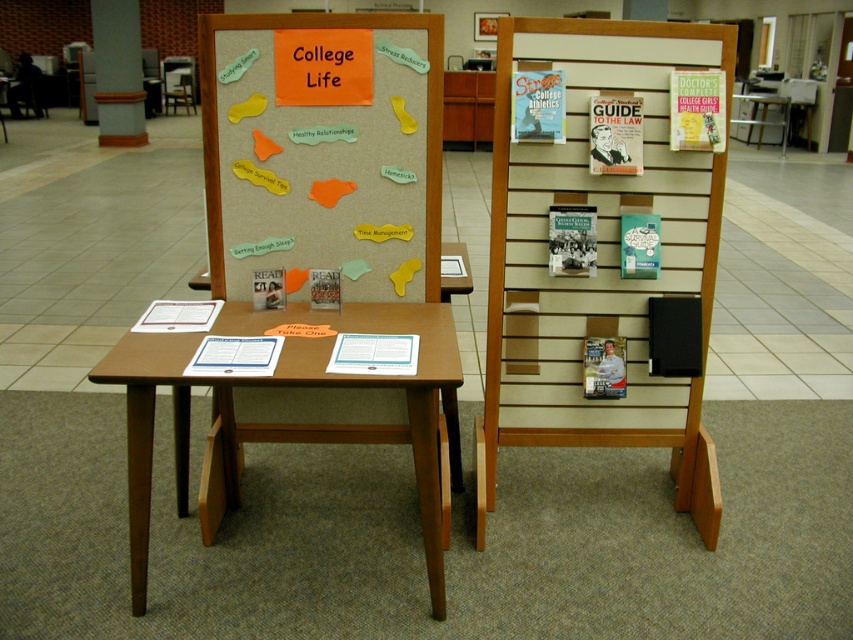
Between brown wooden table at center and smooth concrete pillar at upper left, which one is positioned higher?

smooth concrete pillar at upper left is above.

Who is positioned more to the right, brown wooden table at center or smooth concrete pillar at upper left?

Positioned to the right is brown wooden table at center.

Is point (431, 604) in front of point (111, 19)?

Yes.

Locate an element on the screen. The image size is (853, 640). brown wooden table at center is located at coordinates (285, 422).

Which is below, corkboard at center or brown wooden table at center?

Positioned lower is brown wooden table at center.

Can you confirm if corkboard at center is shorter than brown wooden table at center?

Yes, corkboard at center is shorter than brown wooden table at center.

Locate an element on the screen. corkboard at center is located at coordinates (323, 148).

Who is higher up, brown wooden table at center or matte plastic chair at center?

Positioned higher is matte plastic chair at center.

Between point (341, 317) and point (189, 93), which one is positioned behind?

The point (189, 93) is behind.

Is point (438, 320) less distant than point (187, 97)?

That is True.

I want to click on brown wooden table at center, so click(285, 422).